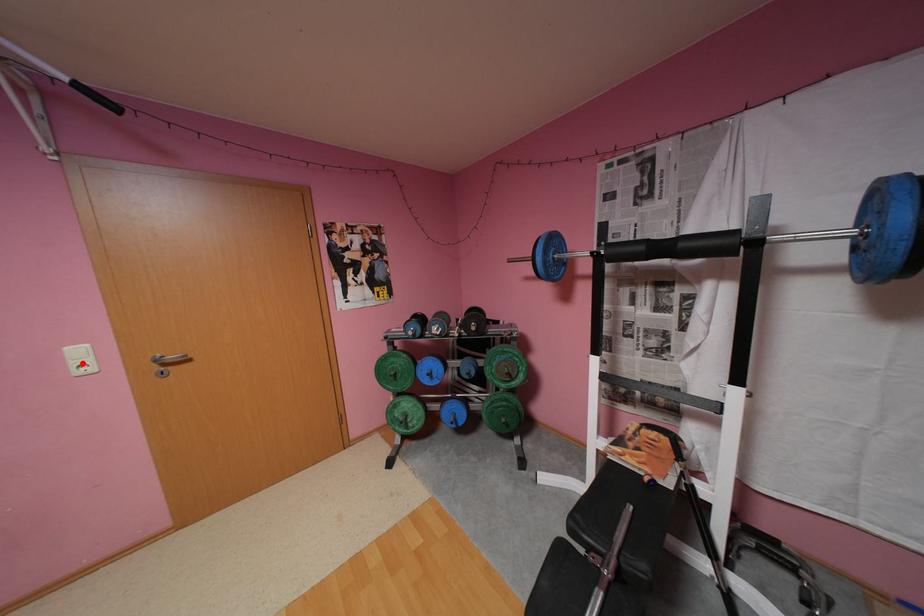
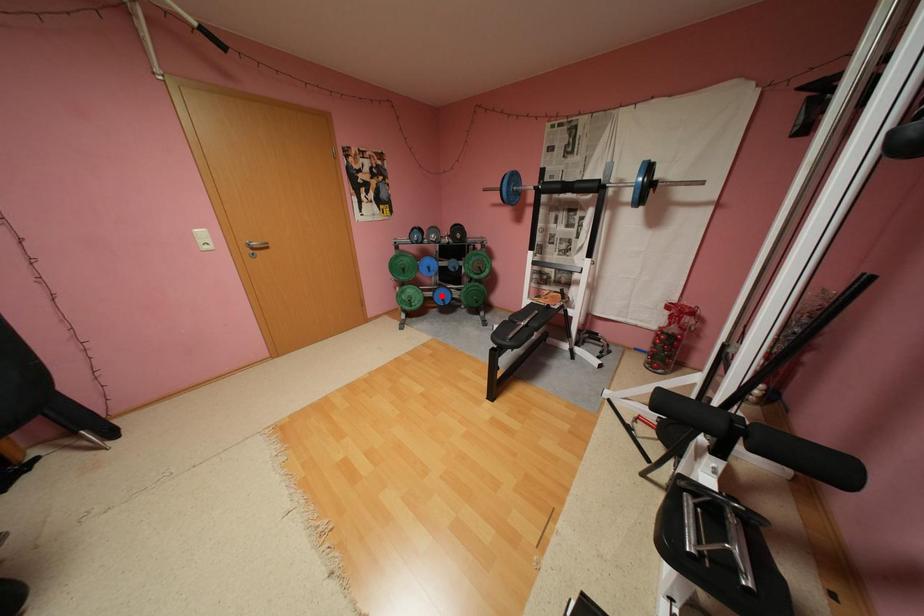
I am providing you with two images of the same scene from different viewpoints. A red point is marked on the first image and another point is marked on the second image. Does the point marked in image1 correspond to the same location as the one in image2?

No